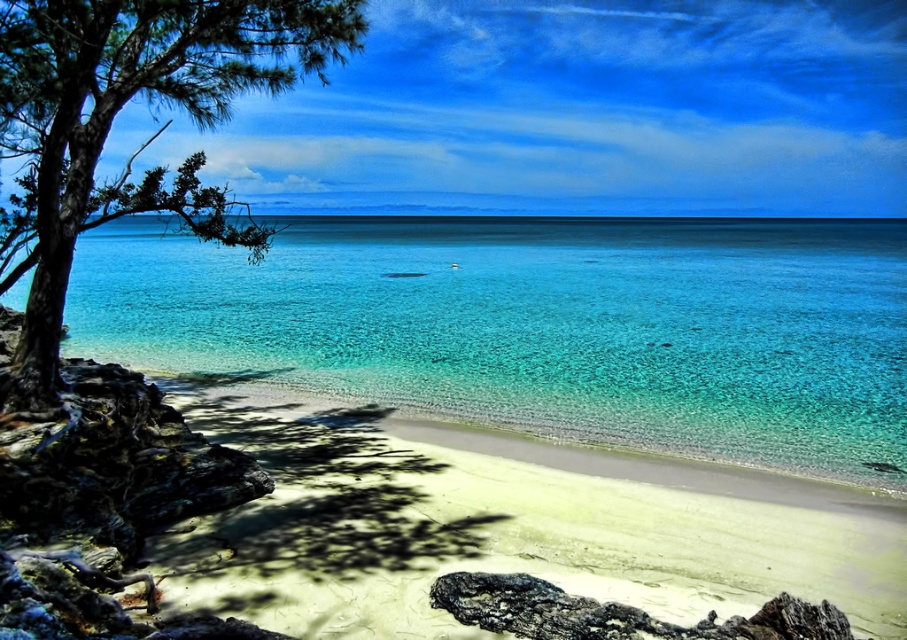
Question: Is clear blue water at center positioned in front of green matte tree at left?

Choices:
 (A) yes
 (B) no

Answer: (A)

Question: Can you confirm if clear blue water at center is thinner than green matte tree at left?

Choices:
 (A) no
 (B) yes

Answer: (A)

Question: Which of the following is the closest to the observer?

Choices:
 (A) green matte tree at left
 (B) clear blue water at center

Answer: (B)

Question: Is clear blue water at center smaller than green matte tree at left?

Choices:
 (A) no
 (B) yes

Answer: (A)